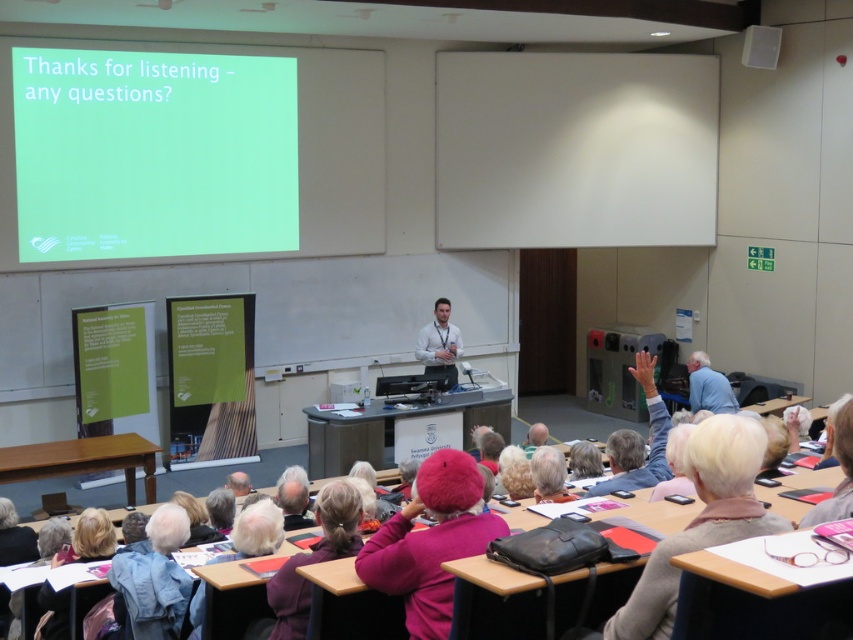
Which is in front, point (180, 595) or point (608, 460)?

Positioned in front is point (180, 595).

Locate an element on the screen. denim jacket at lower left is located at coordinates (154, 579).

You are a GUI agent. You are given a task and a screenshot of the screen. Output one action in this format:
    pyautogui.click(x=<x>, y=<y>)
    Task: Click on the denim jacket at lower left
    
    Given the screenshot: What is the action you would take?
    pyautogui.click(x=154, y=579)

Consider the image. Is green matte projection screen at upper left smaller than blue fabric shirt at upper right?

Incorrect, green matte projection screen at upper left is not smaller in size than blue fabric shirt at upper right.

In the scene shown: Which is more to the left, green matte projection screen at upper left or blue fabric shirt at upper right?

From the viewer's perspective, green matte projection screen at upper left appears more on the left side.

Describe the element at coordinates (154, 154) in the screenshot. I see `green matte projection screen at upper left` at that location.

Where is `green matte projection screen at upper left`? Image resolution: width=853 pixels, height=640 pixels. green matte projection screen at upper left is located at coordinates (154, 154).

Does green matte projection screen at upper left appear over denim jacket at lower left?

Yes, green matte projection screen at upper left is above denim jacket at lower left.

Is green matte projection screen at upper left below denim jacket at lower left?

No.

Who is more distant from viewer, (x=131, y=72) or (x=149, y=600)?

The point (x=131, y=72) is behind.

The image size is (853, 640). In order to click on green matte projection screen at upper left in this screenshot , I will do `click(154, 154)`.